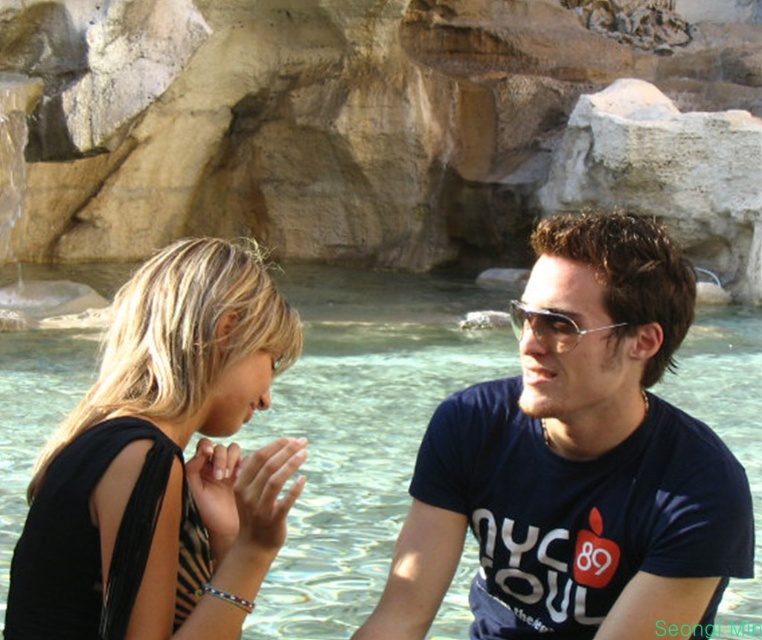
Does point (335, 36) come farther from viewer compared to point (402, 461)?

That is True.

This screenshot has width=762, height=640. What do you see at coordinates (375, 129) in the screenshot? I see `beige stone rock formation at upper center` at bounding box center [375, 129].

At what (x,y) coordinates should I click in order to perform the action: click on beige stone rock formation at upper center. Please return your answer as a coordinate pair (x, y). The width and height of the screenshot is (762, 640). Looking at the image, I should click on (375, 129).

Does point (684, 170) lie in front of point (517, 301)?

No, (684, 170) is behind (517, 301).

Which is behind, point (56, 209) or point (527, 316)?

The point (56, 209) is behind.

Is point (232, 108) farther from camera compared to point (536, 337)?

Yes, it is.

Locate an element on the screen. beige stone rock formation at upper center is located at coordinates (375, 129).

Between clear water at center and metallic silver sunglasses at center, which one is positioned lower?

clear water at center is below.

Between point (444, 304) and point (549, 344), which one is positioned in front?

Positioned in front is point (549, 344).

Between point (309, 515) and point (548, 337), which one is positioned in front?

Point (548, 337) is in front.

Where is `clear water at center`? The height and width of the screenshot is (640, 762). clear water at center is located at coordinates (360, 429).